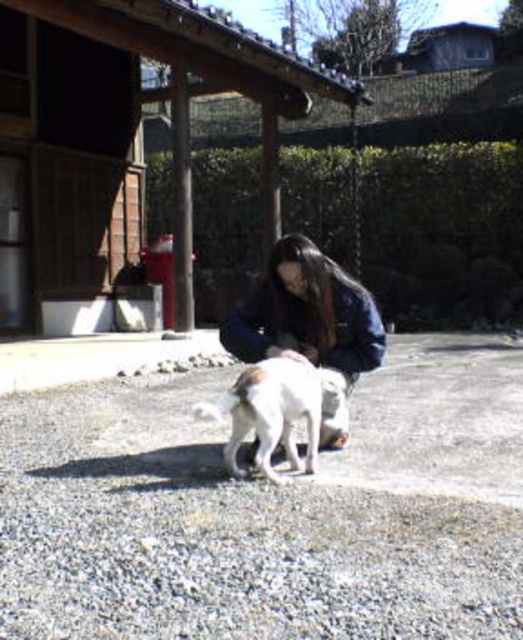
Question: Considering the real-world distances, which object is farthest from the dark blue denim jacket at center?

Choices:
 (A) gray gravel at center
 (B) white fur dog at center

Answer: (A)

Question: Is gray gravel at center below white fur dog at center?

Choices:
 (A) yes
 (B) no

Answer: (A)

Question: Which point appears farthest from the camera in this image?

Choices:
 (A) (493, 628)
 (B) (297, 241)

Answer: (B)

Question: Which of the following is the closest to the observer?

Choices:
 (A) white fur dog at center
 (B) dark blue denim jacket at center

Answer: (A)

Question: Can you confirm if gray gravel at center is thinner than white fur dog at center?

Choices:
 (A) no
 (B) yes

Answer: (A)

Question: Can you confirm if dark blue denim jacket at center is positioned to the left of white fur dog at center?

Choices:
 (A) yes
 (B) no

Answer: (B)